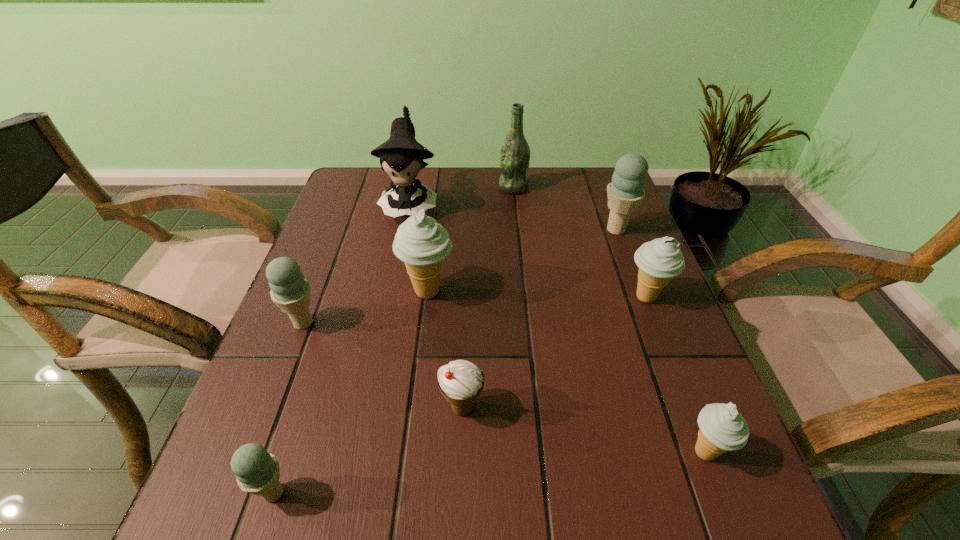
Locate an element on the screen. object positioned at the near left corner is located at coordinates click(x=257, y=472).

The width and height of the screenshot is (960, 540). I want to click on blank area at the far edge, so click(478, 199).

This screenshot has width=960, height=540. What are the coordinates of `vacant space at the left edge` in the screenshot? It's located at (334, 373).

The height and width of the screenshot is (540, 960). Identify the location of free space at the right edge. (671, 455).

Find the location of a particular element. The height and width of the screenshot is (540, 960). vacant region at the far left corner is located at coordinates (351, 192).

Identify the location of vacant point at the far right corner. The height and width of the screenshot is (540, 960). click(x=590, y=173).

At what (x,y) coordinates should I click in order to perform the action: click on free region at the near right corner of the desktop. Please return your answer as a coordinate pair (x, y). Looking at the image, I should click on (684, 491).

Where is `free spot between the nearest ice cream and the doll`? The width and height of the screenshot is (960, 540). free spot between the nearest ice cream and the doll is located at coordinates (342, 349).

You are a GUI agent. You are given a task and a screenshot of the screen. Output one action in this format:
    pyautogui.click(x=<x>, y=<y>)
    Task: Click on the free point between the green beer bottle and the smallest blue ice cream
    
    Given the screenshot: What is the action you would take?
    pyautogui.click(x=394, y=340)

Where is `free space between the nearest blue ice cream and the green beer bottle`? free space between the nearest blue ice cream and the green beer bottle is located at coordinates (394, 340).